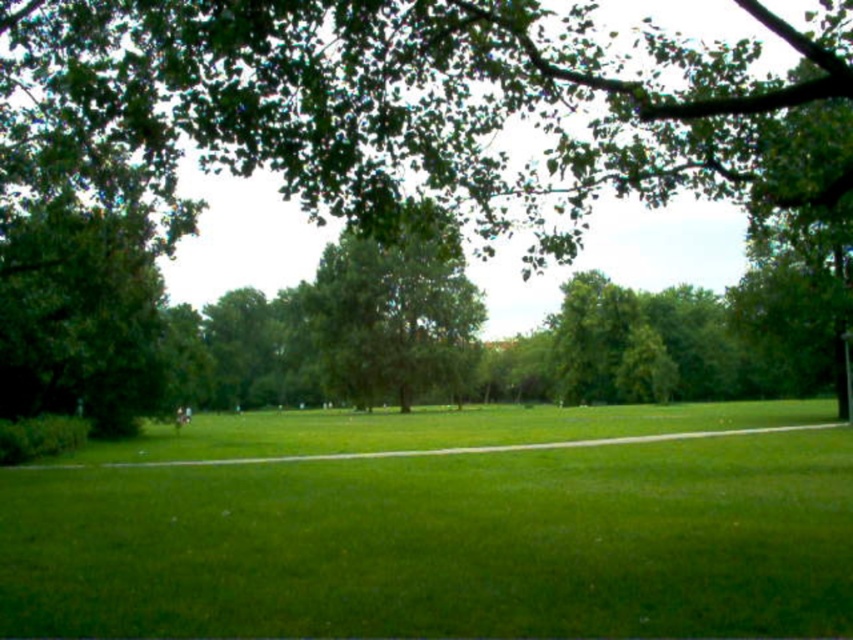
Question: Among these points, which one is nearest to the camera?

Choices:
 (A) (67, 33)
 (B) (456, 570)

Answer: (B)

Question: Is green grass at center closer to camera compared to green leafy tree at upper center?

Choices:
 (A) no
 (B) yes

Answer: (A)

Question: Which object is closer to the camera taking this photo?

Choices:
 (A) green grass at center
 (B) green leafy tree at upper center
 (C) green leafy tree at left

Answer: (B)

Question: Considering the relative positions of green grass at center and green leafy tree at left in the image provided, where is green grass at center located with respect to green leafy tree at left?

Choices:
 (A) right
 (B) left

Answer: (A)

Question: Can you confirm if green leafy tree at left is positioned above green leafy tree at center?

Choices:
 (A) no
 (B) yes

Answer: (A)

Question: Which of these objects is positioned farthest from the green leafy tree at left?

Choices:
 (A) green leafy tree at upper center
 (B) green leafy tree at center

Answer: (B)